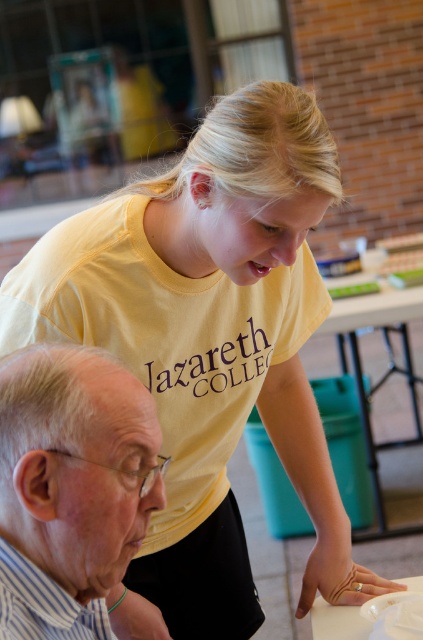
Is white striped fabric at lower left positioned before white glossy table at lower center?

Yes, white striped fabric at lower left is closer to the viewer.

I want to click on white striped fabric at lower left, so 43,604.

Between striped fabric shirt at lower left and green plastic table at center, which one has less height?

Standing shorter between the two is striped fabric shirt at lower left.

Identify the location of striped fabric shirt at lower left. This screenshot has height=640, width=423. (76, 465).

Who is shorter, striped fabric shirt at lower left or white striped fabric at lower left?

With less height is white striped fabric at lower left.

From the picture: Does striped fabric shirt at lower left have a greater width compared to white striped fabric at lower left?

Correct, the width of striped fabric shirt at lower left exceeds that of white striped fabric at lower left.

Is point (63, 456) positioned behind point (5, 556)?

Yes.

Where is `striped fabric shirt at lower left`? Image resolution: width=423 pixels, height=640 pixels. striped fabric shirt at lower left is located at coordinates (76, 465).